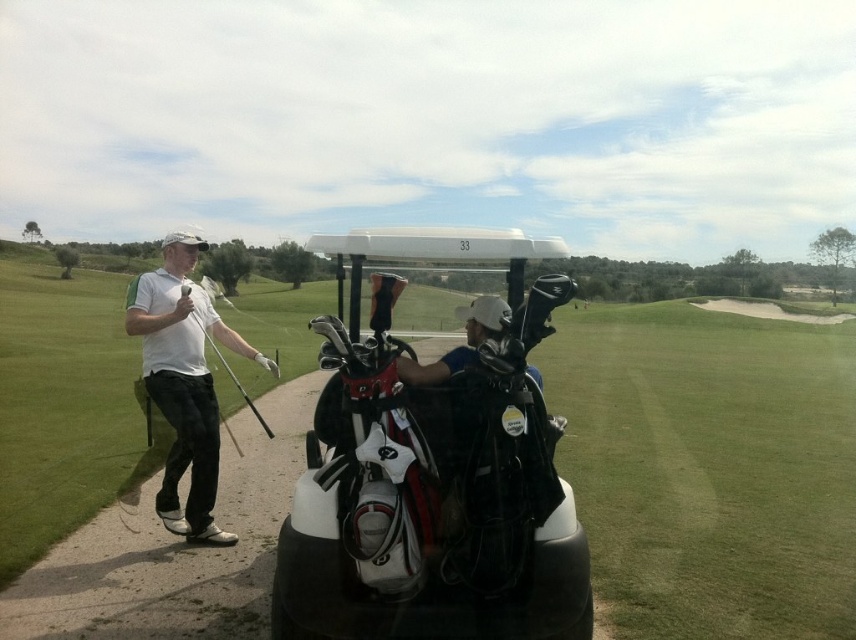
Question: Is white matte golf cart at center positioned before matte black golf club at left?

Choices:
 (A) yes
 (B) no

Answer: (A)

Question: Is green grass golf course at center smaller than white matte golf club at left?

Choices:
 (A) yes
 (B) no

Answer: (B)

Question: Does green grass golf course at center have a smaller size compared to matte black golf club at left?

Choices:
 (A) no
 (B) yes

Answer: (A)

Question: Which point is closer to the camera?

Choices:
 (A) (180, 289)
 (B) (205, 410)
 (C) (377, 412)

Answer: (C)

Question: Which point is closer to the camera?

Choices:
 (A) white matte golf cart at center
 (B) white matte golf club at left
 (C) matte black golf club at left
 (D) green grass golf course at center

Answer: (A)

Question: Which point appears farthest from the camera in this image?

Choices:
 (A) click(158, 461)
 (B) click(394, 380)

Answer: (A)